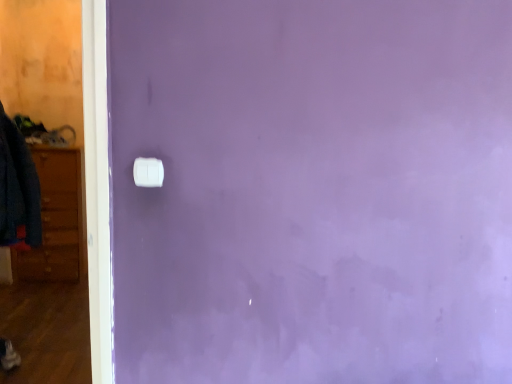
Question: Would you say white plastic light switch at center is a long distance from denim jacket at left?

Choices:
 (A) no
 (B) yes

Answer: (B)

Question: Can you confirm if white plastic light switch at center is thinner than denim jacket at left?

Choices:
 (A) yes
 (B) no

Answer: (A)

Question: Does white plastic light switch at center have a smaller size compared to denim jacket at left?

Choices:
 (A) no
 (B) yes

Answer: (B)

Question: From a real-world perspective, is white plastic light switch at center beneath denim jacket at left?

Choices:
 (A) yes
 (B) no

Answer: (B)

Question: From the image's perspective, is white plastic light switch at center below denim jacket at left?

Choices:
 (A) no
 (B) yes

Answer: (B)

Question: Is white plastic light switch at center taller than denim jacket at left?

Choices:
 (A) no
 (B) yes

Answer: (A)

Question: Is white plastic light switch at center a part of denim jacket at left?

Choices:
 (A) yes
 (B) no

Answer: (B)

Question: From the image's perspective, is denim jacket at left under white plastic light switch at center?

Choices:
 (A) no
 (B) yes

Answer: (A)

Question: Is denim jacket at left closer to camera compared to white plastic light switch at center?

Choices:
 (A) no
 (B) yes

Answer: (A)

Question: Is denim jacket at left bigger than white plastic light switch at center?

Choices:
 (A) no
 (B) yes

Answer: (B)

Question: Can we say denim jacket at left lies outside white plastic light switch at center?

Choices:
 (A) yes
 (B) no

Answer: (A)

Question: From the image's perspective, is denim jacket at left on top of white plastic light switch at center?

Choices:
 (A) yes
 (B) no

Answer: (A)

Question: Considering their positions, is white plastic light switch at center located in front of or behind denim jacket at left?

Choices:
 (A) behind
 (B) front

Answer: (B)